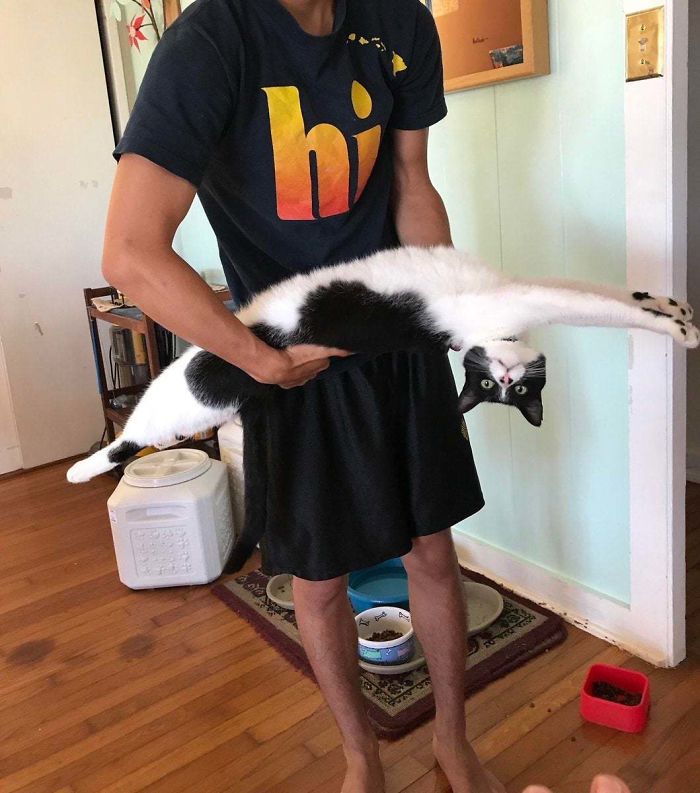
Identify the location of wall. (566, 457).